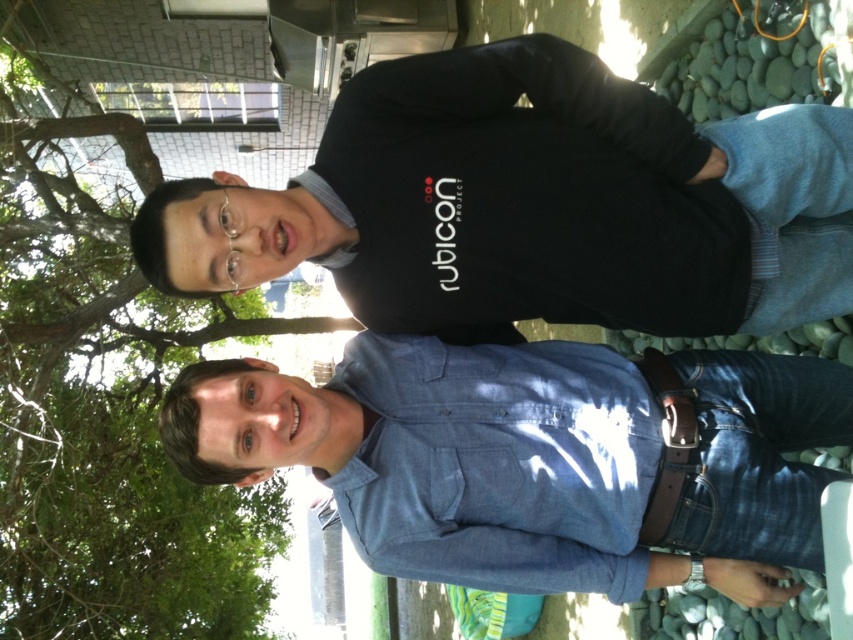
The width and height of the screenshot is (853, 640). Find the location of `blue denim shirt at center`. blue denim shirt at center is located at coordinates (527, 456).

How much distance is there between blue denim shirt at center and green leafy tree at upper left?

4.81 meters

Between point (738, 552) and point (67, 388), which one is positioned behind?

The point (67, 388) is behind.

This screenshot has width=853, height=640. What are the coordinates of `blue denim shirt at center` in the screenshot? It's located at (527, 456).